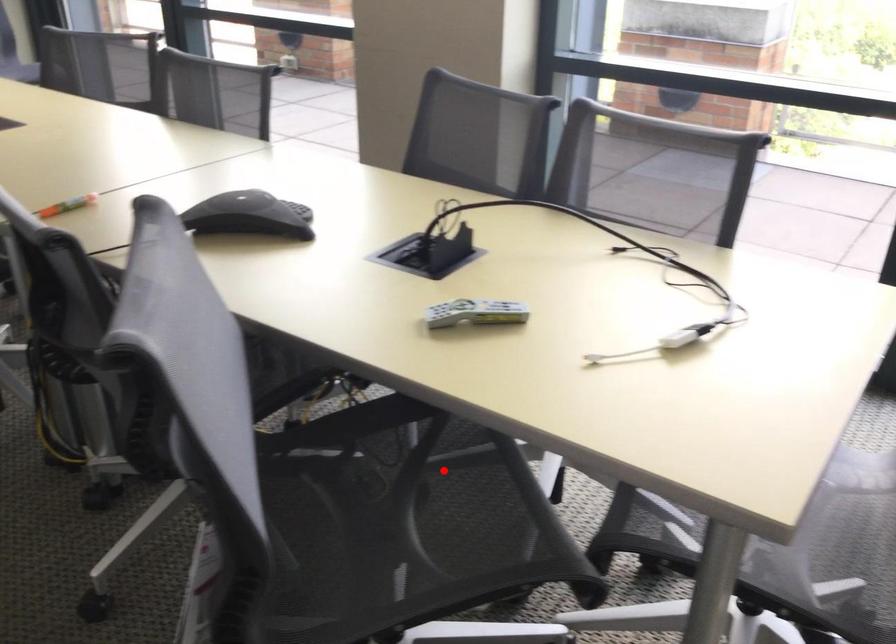
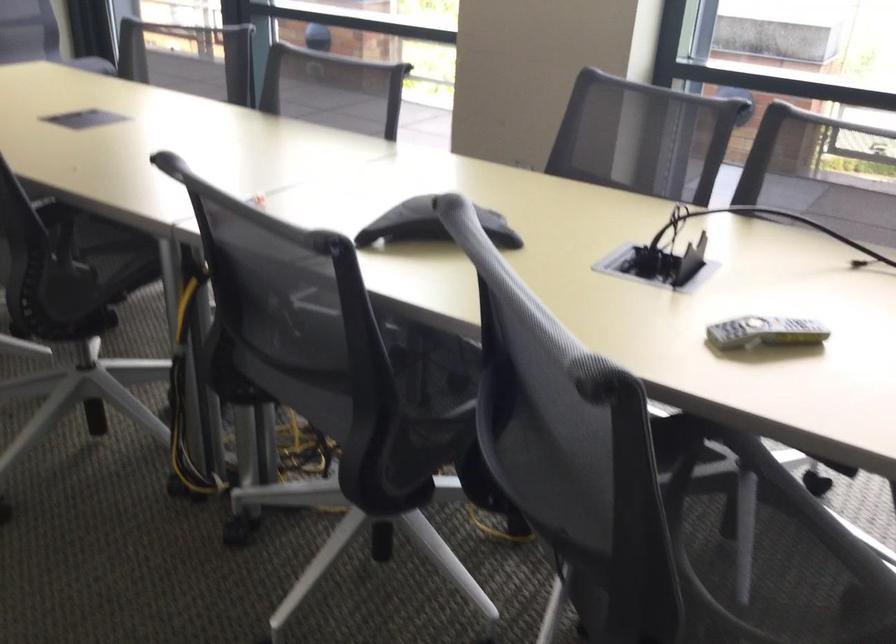
Find the pixel in the second image that matches the highlighted location in the first image.

(735, 507)